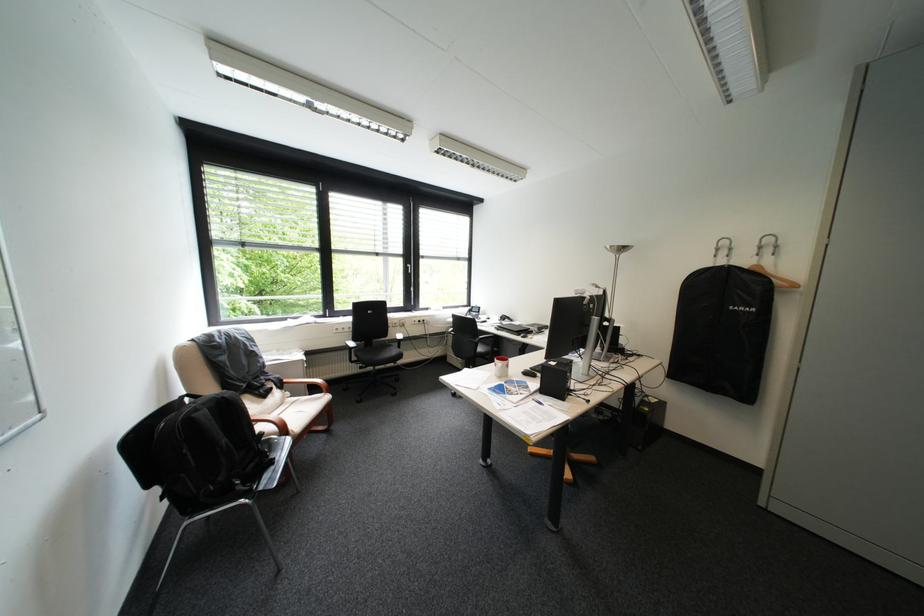
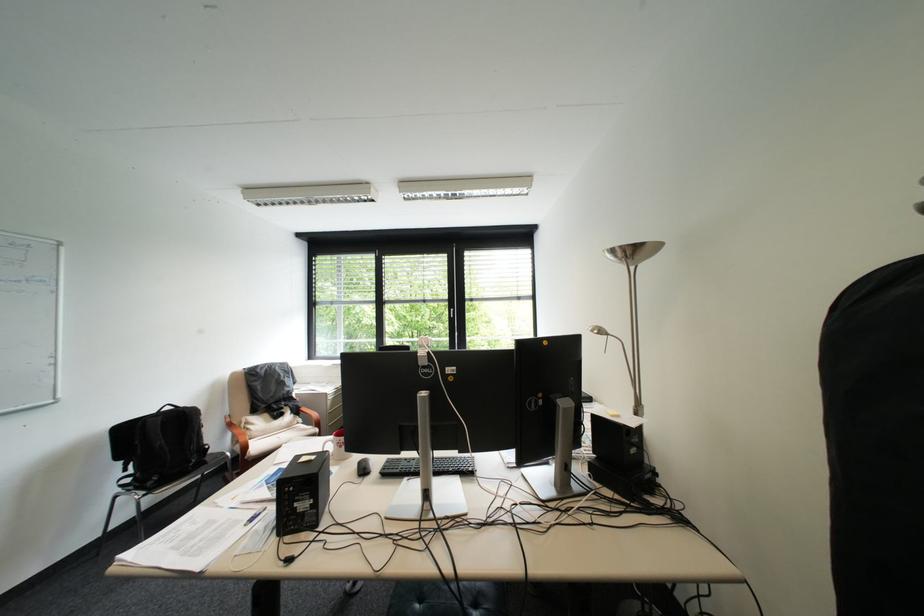
In the second image, find the point that corresponds to [623,246] in the first image.

(625, 252)